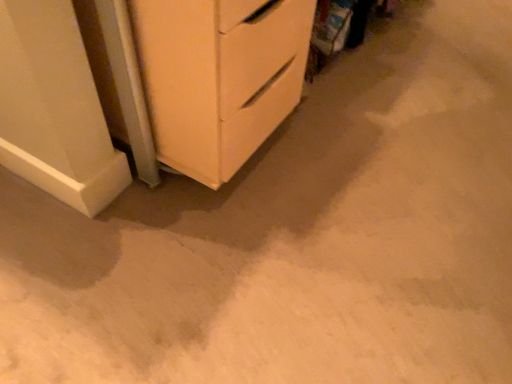
What do you see at coordinates (220, 77) in the screenshot? I see `matte wood chest of drawers at lower left` at bounding box center [220, 77].

Where is `matte wood chest of drawers at lower left`? matte wood chest of drawers at lower left is located at coordinates (220, 77).

Measure the distance between point [157,22] and camera.

They are 33.94 inches apart.

The width and height of the screenshot is (512, 384). I want to click on matte wood chest of drawers at lower left, so click(x=220, y=77).